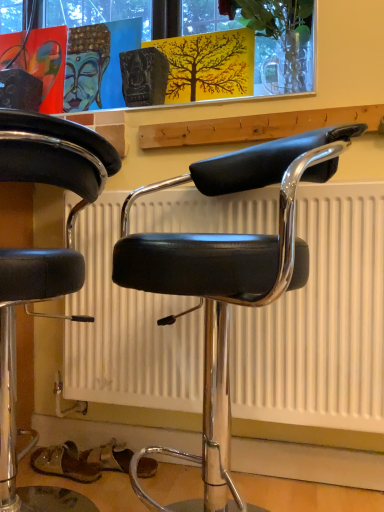
Question: From their relative heights in the image, would you say black leather stool at left, marked as the 1th chair in a left-to-right arrangement, is taller or shorter than black leather chair at center, which is counted as the 2th chair, starting from the left?

Choices:
 (A) short
 (B) tall

Answer: (B)

Question: Based on their sizes in the image, would you say black leather stool at left, marked as the 1th chair in a left-to-right arrangement, is bigger or smaller than black leather chair at center, which is the 1th chair from right to left?

Choices:
 (A) small
 (B) big

Answer: (B)

Question: Estimate the real-world distances between objects in this image. Which object is closer to the black leather chair at center, which is the 1th chair from right to left?

Choices:
 (A) translucent glass vase at upper center
 (B) black leather stool at left, marked as the 1th chair in a left-to-right arrangement

Answer: (B)

Question: Based on their relative distances, which object is nearer to the translucent glass vase at upper center?

Choices:
 (A) black leather chair at center, which is counted as the 2th chair, starting from the left
 (B) black leather stool at left, which is counted as the 2th chair, starting from the right

Answer: (A)